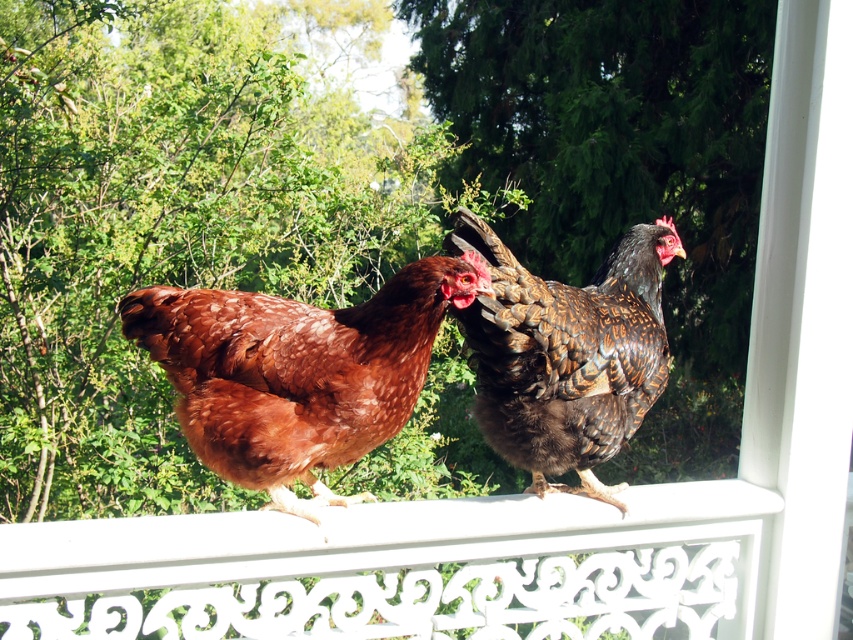
Question: Is brown feathered chicken at center to the right of brown speckled chicken at center from the viewer's perspective?

Choices:
 (A) no
 (B) yes

Answer: (A)

Question: From the image, what is the correct spatial relationship of brown feathered chicken at center in relation to brown speckled chicken at center?

Choices:
 (A) left
 (B) right

Answer: (A)

Question: Which point is farther from the camera taking this photo?

Choices:
 (A) (581, 332)
 (B) (247, 294)

Answer: (A)

Question: Among these points, which one is farthest from the camera?

Choices:
 (A) click(x=514, y=355)
 (B) click(x=242, y=372)

Answer: (A)

Question: Does brown feathered chicken at center appear over brown speckled chicken at center?

Choices:
 (A) yes
 (B) no

Answer: (B)

Question: Which point appears closest to the camera in this image?

Choices:
 (A) (573, 358)
 (B) (248, 340)

Answer: (B)